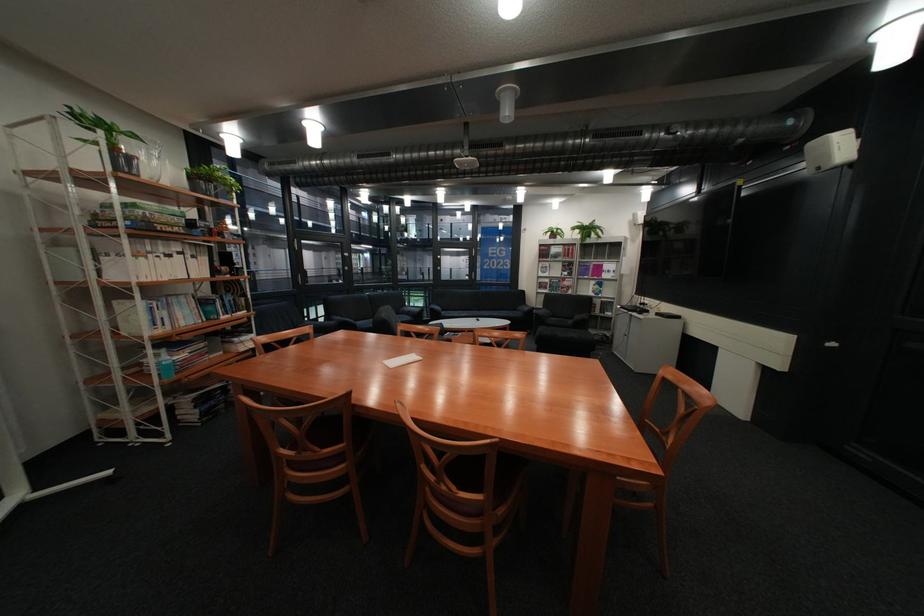
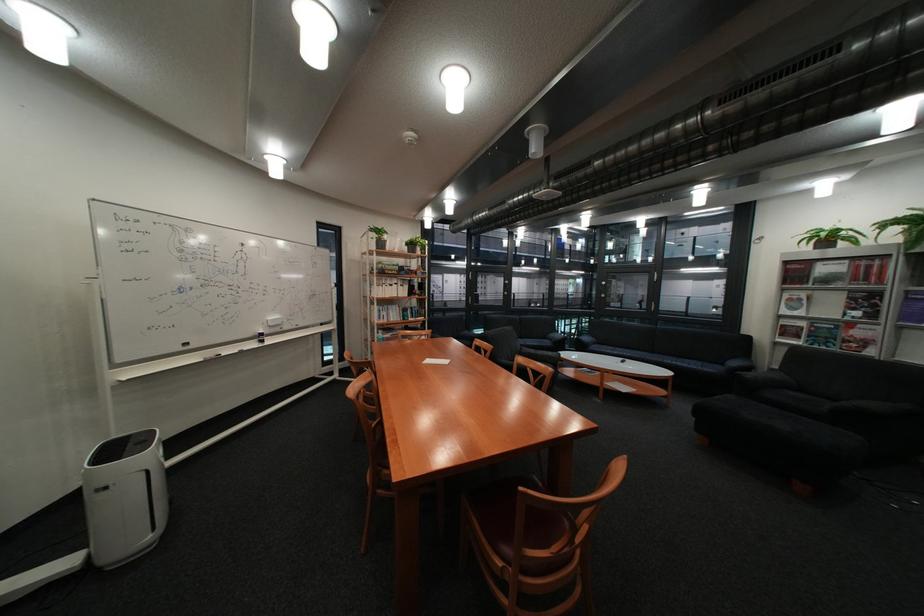
Locate, in the second image, the point that corresponds to (531,310) in the first image.

(737, 363)